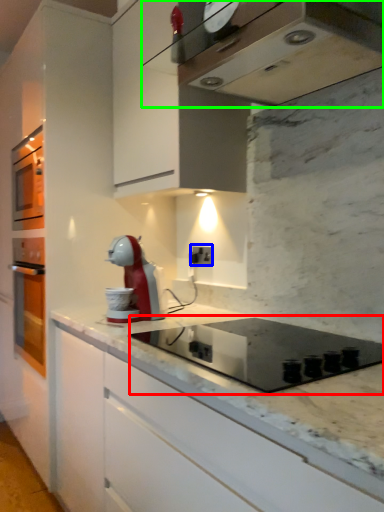
Question: Which object is positioned farthest from appliance (highlighted by a red box)? Select from electric outlet (highlighted by a blue box) and home appliance (highlighted by a green box).

Choices:
 (A) electric outlet
 (B) home appliance

Answer: (B)